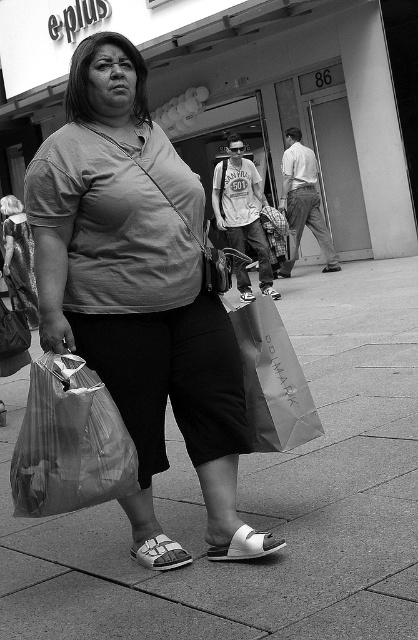
Is point (323, 524) less distant than point (86, 385)?

No.

Does smooth concrete sidewalk at center have a lesser width compared to translucent plastic bag at lower left?

Correct, smooth concrete sidewalk at center's width is less than translucent plastic bag at lower left's.

What are the coordinates of `smooth concrete sidewalk at center` in the screenshot? It's located at (257, 500).

At what (x,y) coordinates should I click in order to perform the action: click on smooth concrete sidewalk at center. Please return your answer as a coordinate pair (x, y). The width and height of the screenshot is (418, 640). Looking at the image, I should click on (257, 500).

Is translucent plastic bag at lower left behind matte paper bag at center?

No, it is not.

Describe the element at coordinates (69, 442) in the screenshot. The width and height of the screenshot is (418, 640). I see `translucent plastic bag at lower left` at that location.

The image size is (418, 640). In order to click on translucent plastic bag at lower left in this screenshot , I will do `click(69, 442)`.

Locate an element on the screen. translucent plastic bag at lower left is located at coordinates (69, 442).

Does matte gray shirt at center have a smaller size compared to matte paper bag at center?

No.

Which is behind, point (157, 566) or point (275, 410)?

Point (275, 410)

Which is in front, point (119, 144) or point (239, 314)?

Positioned in front is point (119, 144).

Identify the location of matte gray shirt at center. (140, 292).